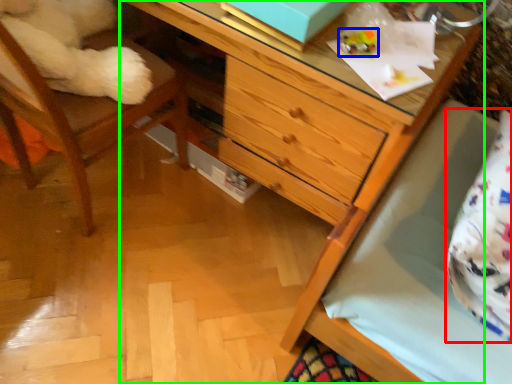
Question: Which object is positioned farthest from pillow (highlighted by a red box)? Select from toy (highlighted by a blue box) and chest of drawers (highlighted by a green box).

Choices:
 (A) toy
 (B) chest of drawers

Answer: (A)